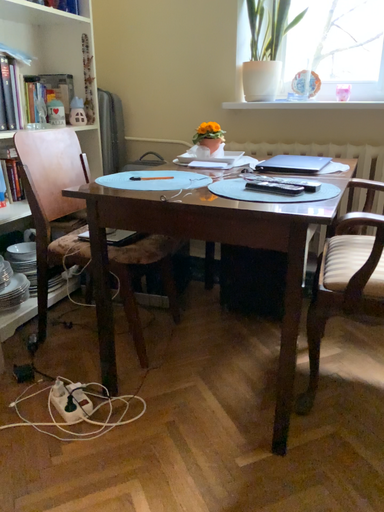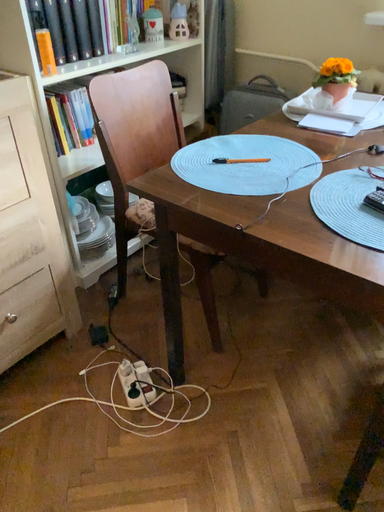
Question: How did the camera likely rotate when shooting the video?

Choices:
 (A) rotated left
 (B) rotated right

Answer: (A)